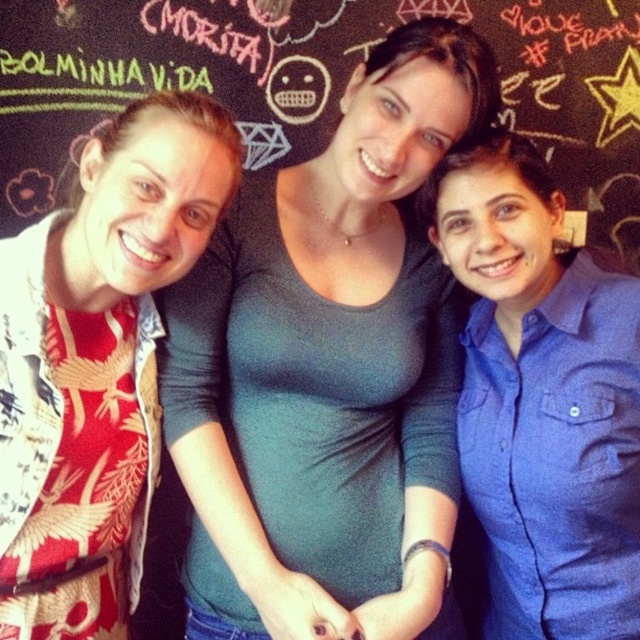
Question: In this image, where is black chalkboard at center located relative to blue cotton shirt at center?

Choices:
 (A) above
 (B) below

Answer: (A)

Question: Which object appears closest to the camera in this image?

Choices:
 (A) green matte shirt at center
 (B) blue cotton shirt at center

Answer: (A)

Question: Does printed silk blouse at left appear under black chalkboard at center?

Choices:
 (A) yes
 (B) no

Answer: (A)

Question: Where is black chalkboard at center located in relation to blue cotton shirt at center in the image?

Choices:
 (A) above
 (B) below

Answer: (A)

Question: Estimate the real-world distances between objects in this image. Which object is closer to the green matte shirt at center?

Choices:
 (A) blue cotton shirt at center
 (B) printed silk blouse at left
 (C) black chalkboard at center

Answer: (A)

Question: Among these points, which one is farthest from the camera?

Choices:
 (A) (45, 573)
 (B) (428, 518)
 (C) (38, 125)

Answer: (C)